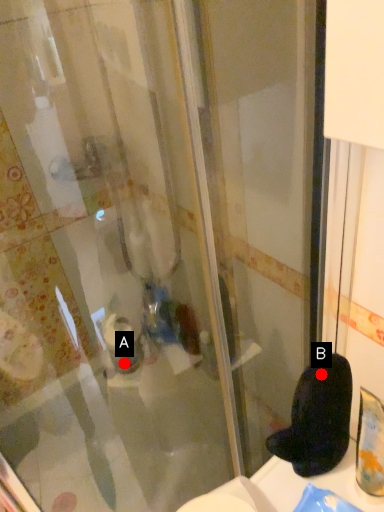
Question: Two points are circled on the image, labeled by A and B beside each circle. Which of the following is the farthest from the observer?

Choices:
 (A) A is further
 (B) B is further

Answer: (A)